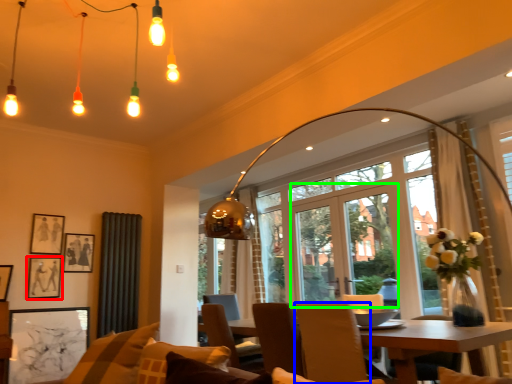
Question: Which object is the farthest from picture frame (highlighted by a red box)? Choose among these: chair (highlighted by a blue box) or screen door (highlighted by a green box).

Choices:
 (A) chair
 (B) screen door

Answer: (B)